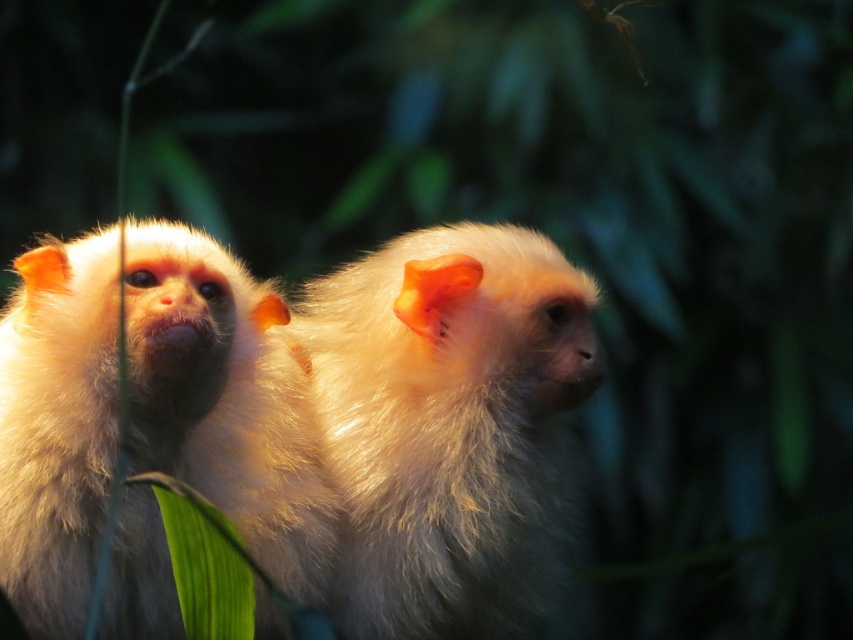
Which of these two, white fluffy monkey at center or fluffy white monkey at center, stands shorter?

Standing shorter between the two is white fluffy monkey at center.

Is white fluffy monkey at center thinner than fluffy white monkey at center?

No.

Between point (316, 522) and point (531, 278), which one is positioned in front?

Point (316, 522)

The image size is (853, 640). Find the location of `white fluffy monkey at center`. white fluffy monkey at center is located at coordinates (225, 400).